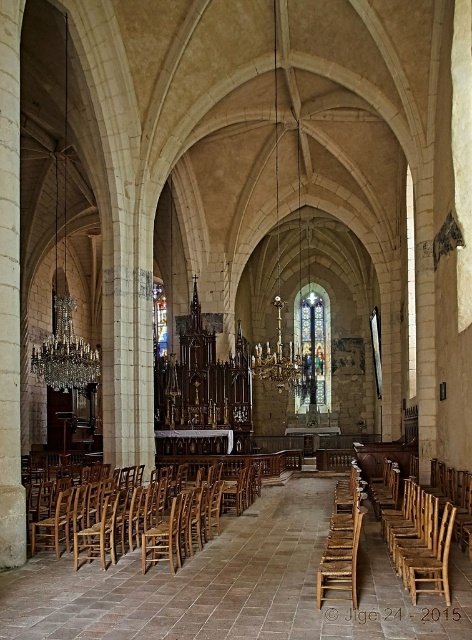
You are an interior designer planning to place a new table between the wooden chair at left and the rustic wood chair at right in the church. Which chair should the table be placed closer to if you want it to be equidistant from both chairs?

The table should be placed closer to the rustic wood chair at right because the wooden chair at left is larger, so positioning the table nearer to the smaller rustic wood chair at right ensures equal distance from both chairs.

You are an interior designer assessing the space for seating arrangements. You need to place a new rectangular table that is 1.2 meters wide between the rustic wood chair at right and the worn wood chair at center. Based on their widths, will the table fit snugly between them without overlapping either chair?

The rustic wood chair at right is wider than the worn wood chair at center. Since the table is 1.2 meters wide, the total space between the chairs must be at least 1.2 meters. However, without knowing the exact distance between the chairs, we can only confirm that the rustic wood chair at right is wider, but the table may or may not fit depending on the actual spacing.